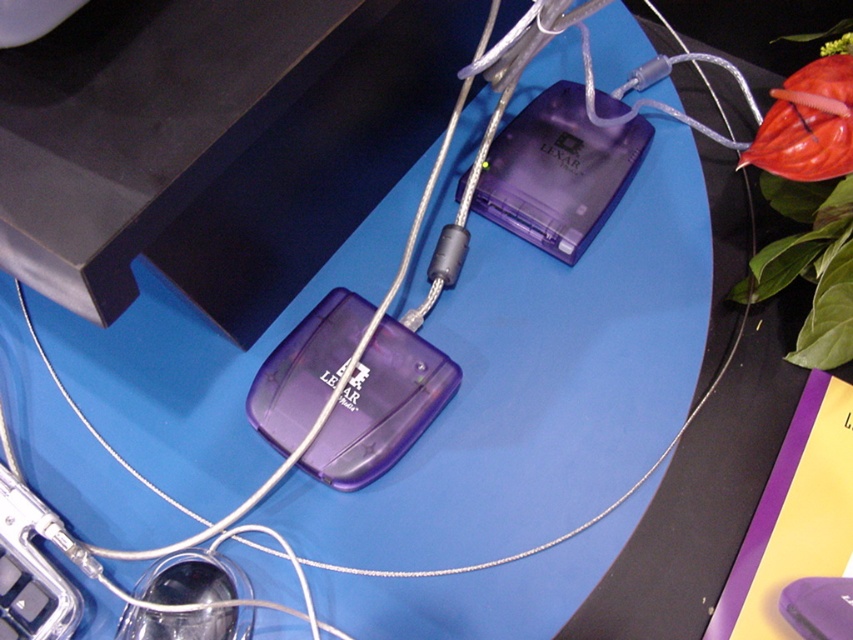
Consider the image. You are setting up a workspace and want to place both the transparent plastic lexar flash drive at center and the transparent plastic mouse at lower left on your desk. If your desk has a 16 inch wide shelf, will both items fit side by side on it?

The transparent plastic lexar flash drive at center and transparent plastic mouse at lower left are 15.98 inches apart from each other, so they can fit side by side on the 16 inch wide shelf since the total width required is slightly less than 16 inches.

You are organizing a desk and need to place a red pen between the transparent plastic lexar flash drive at center and the transparent plastic mouse at lower left. Based on their positions, which object should the pen be closer to?

The pen should be closer to the transparent plastic mouse at lower left because the transparent plastic lexar flash drive at center is closer to you than the mouse, so placing the pen between them would require it to be nearer to the mouse which is farther away.

You are organizing items on your desk and need to stack the transparent plastic lexar flash drive at center and the transparent plastic mouse at lower left vertically. Which item should be placed at the bottom to ensure stability?

The transparent plastic lexar flash drive at center has a greater height compared to the transparent plastic mouse at lower left, so it should be placed at the bottom to provide a stable base for the stack.